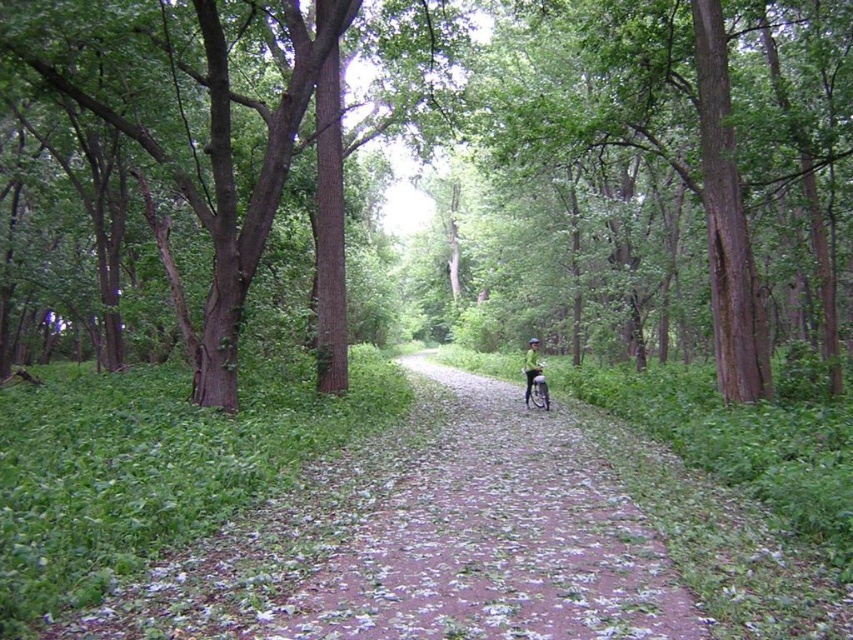
Question: Which point is closer to the camera taking this photo?

Choices:
 (A) (287, 124)
 (B) (538, 604)

Answer: (B)

Question: Among these objects, which one is farthest from the camera?

Choices:
 (A) green fabric helmet at center
 (B) brown dirt path at center
 (C) brown rough tree at center

Answer: (A)

Question: Which of the following is the farthest from the observer?

Choices:
 (A) (222, 403)
 (B) (410, 611)
 (C) (537, 355)

Answer: (C)

Question: Can you confirm if brown dirt path at center is wider than green fabric helmet at center?

Choices:
 (A) no
 (B) yes

Answer: (B)

Question: Is brown dirt path at center thinner than green fabric helmet at center?

Choices:
 (A) yes
 (B) no

Answer: (B)

Question: Can you confirm if brown rough tree at center is positioned to the right of green fabric helmet at center?

Choices:
 (A) yes
 (B) no

Answer: (B)